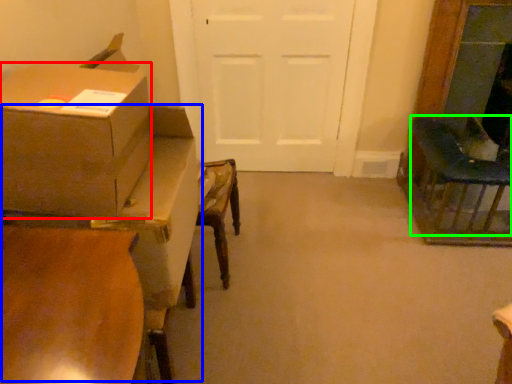
Question: Estimate the real-world distances between objects in this image. Which object is farther from box (highlighted by a red box), table (highlighted by a blue box) or chair (highlighted by a green box)?

Choices:
 (A) table
 (B) chair

Answer: (B)